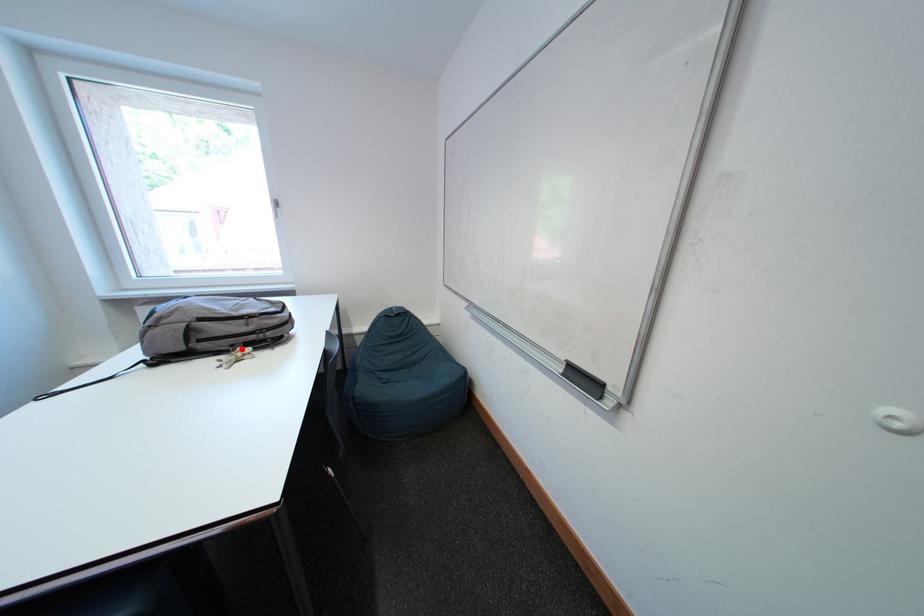
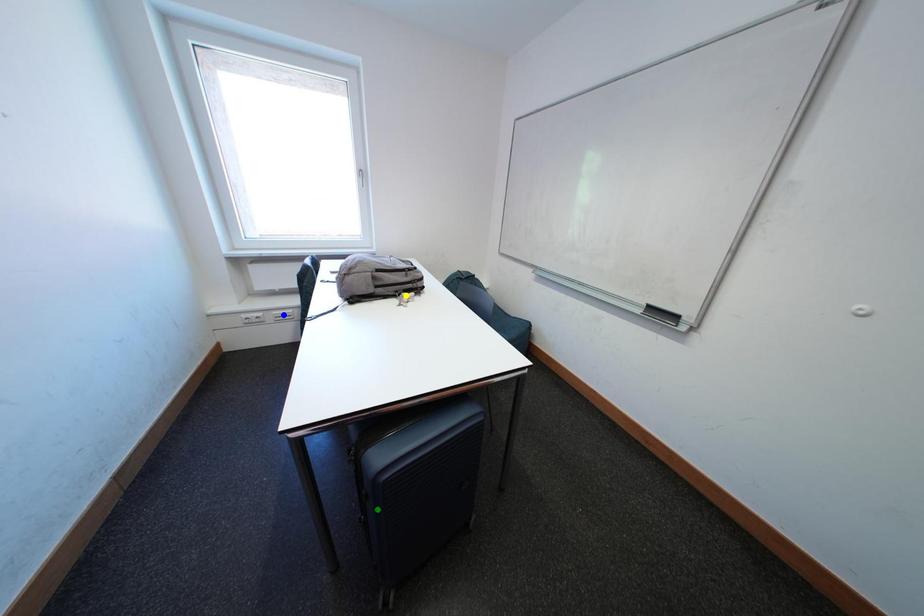
Question: I am providing you with two images of the same scene from different viewpoints. A red point is marked on the first image. You are given multiple points on the second image. Can you choose the point in image 2 that corresponds to the point in image 1?

Choices:
 (A) green point
 (B) blue point
 (C) yellow point

Answer: (C)